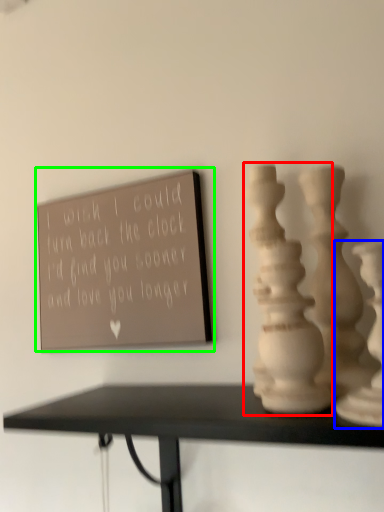
Question: Based on their relative distances, which object is farther from vase (highlighted by a red box)? Choose from vase (highlighted by a blue box) and bulletin board (highlighted by a green box).

Choices:
 (A) vase
 (B) bulletin board

Answer: (B)